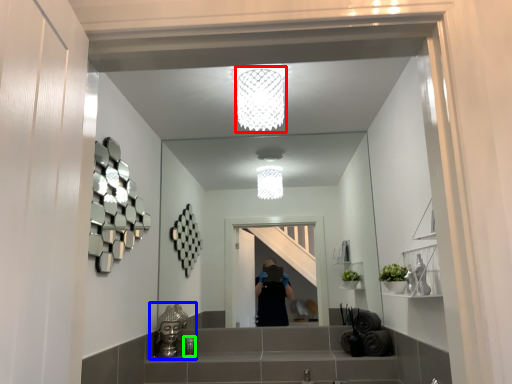
Question: Estimate the real-world distances between objects in this image. Which object is farther from light fixture (highlighted by a red box), sink (highlighted by a blue box) or toiletry (highlighted by a green box)?

Choices:
 (A) sink
 (B) toiletry

Answer: (B)